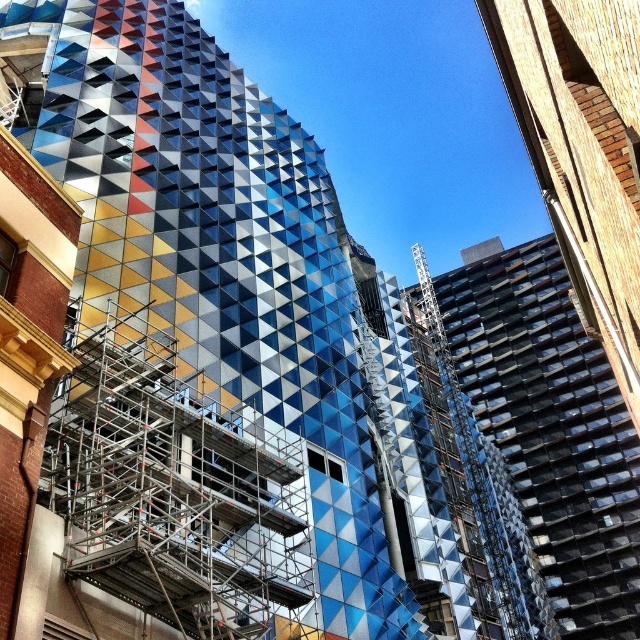
Question: Is metallic geometric facade at center positioned at the back of silver metallic scaffolding at center?

Choices:
 (A) no
 (B) yes

Answer: (B)

Question: Is metallic geometric facade at center bigger than silver metallic scaffolding at center?

Choices:
 (A) yes
 (B) no

Answer: (A)

Question: Which object appears farthest from the camera in this image?

Choices:
 (A) silver metallic scaffolding at center
 (B) metallic geometric facade at center

Answer: (B)

Question: Does metallic geometric facade at center have a greater width compared to silver metallic scaffolding at center?

Choices:
 (A) yes
 (B) no

Answer: (A)

Question: Which of the following is the closest to the observer?

Choices:
 (A) metallic geometric facade at center
 (B) silver metallic scaffolding at center

Answer: (B)

Question: Which point is closer to the camera?

Choices:
 (A) silver metallic scaffolding at center
 (B) metallic geometric facade at center

Answer: (A)